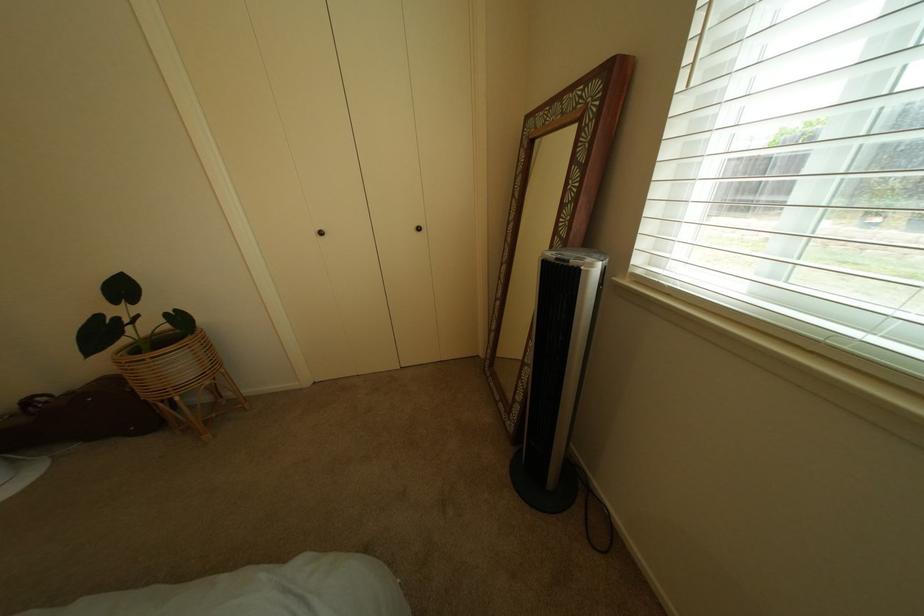
What do you see at coordinates (570, 256) in the screenshot?
I see `the fan control panel` at bounding box center [570, 256].